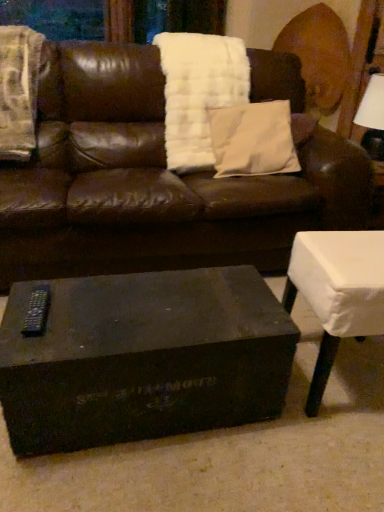
Where is `free space on the front side of white cloth-covered table at lower right`? This screenshot has width=384, height=512. free space on the front side of white cloth-covered table at lower right is located at coordinates (326, 455).